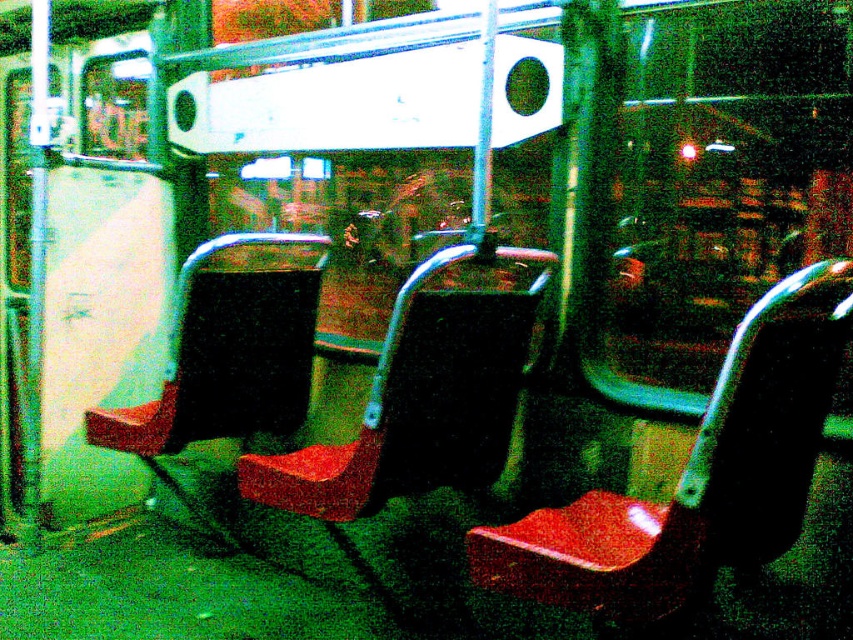
You are a passenger on a bus and need to find a seat. You see the matte red seat at center and the matte black seat at left. Which seat is closer to the front of the bus?

The matte red seat at center is in front of the matte black seat at left, so the matte red seat at center is closer to the front of the bus.

You are a passenger on a bus and need to sit down. You see a matte plastic chair at center and a matte black seat at left. Which seat is closer to you?

The matte plastic chair at center is closer to the viewer than the matte black seat at left, so you should choose the matte plastic chair at center as it is nearer to your current position.

You are a passenger on a bus and need to choose between sitting on the matte red seat at center or the matte black seat at left. Which seat is shorter in height?

The matte red seat at center has a lesser height compared to the matte black seat at left, so the matte red seat at center is shorter.